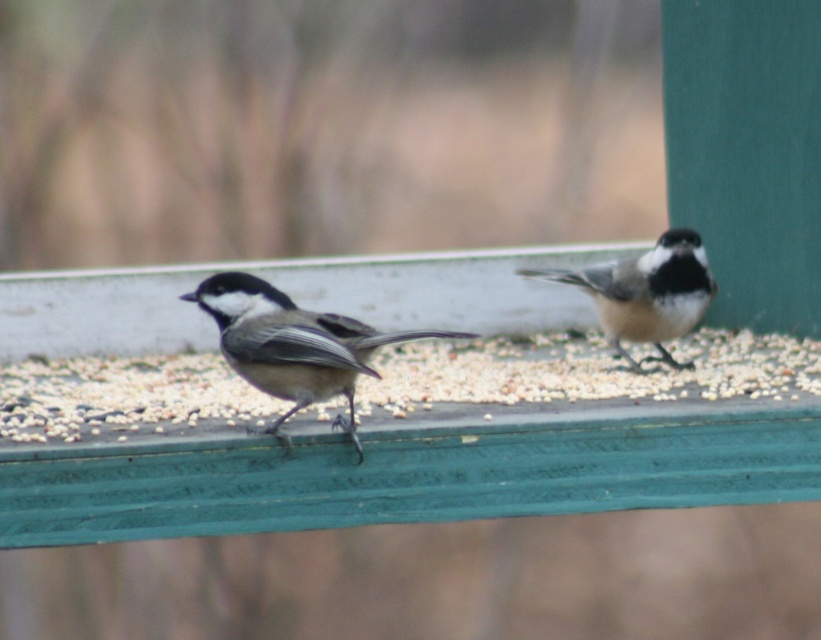
Question: Among these points, which one is nearest to the camera?

Choices:
 (A) (324, 390)
 (B) (682, 250)

Answer: (A)

Question: Does gray matte bird at center appear over white speckled feathers at center?

Choices:
 (A) yes
 (B) no

Answer: (B)

Question: Is gray matte bird at center positioned in front of white speckled feathers at center?

Choices:
 (A) no
 (B) yes

Answer: (B)

Question: Which object appears farthest from the camera in this image?

Choices:
 (A) white speckled feathers at center
 (B) gray matte bird at center

Answer: (A)

Question: Is gray matte bird at center behind white speckled feathers at center?

Choices:
 (A) yes
 (B) no

Answer: (B)